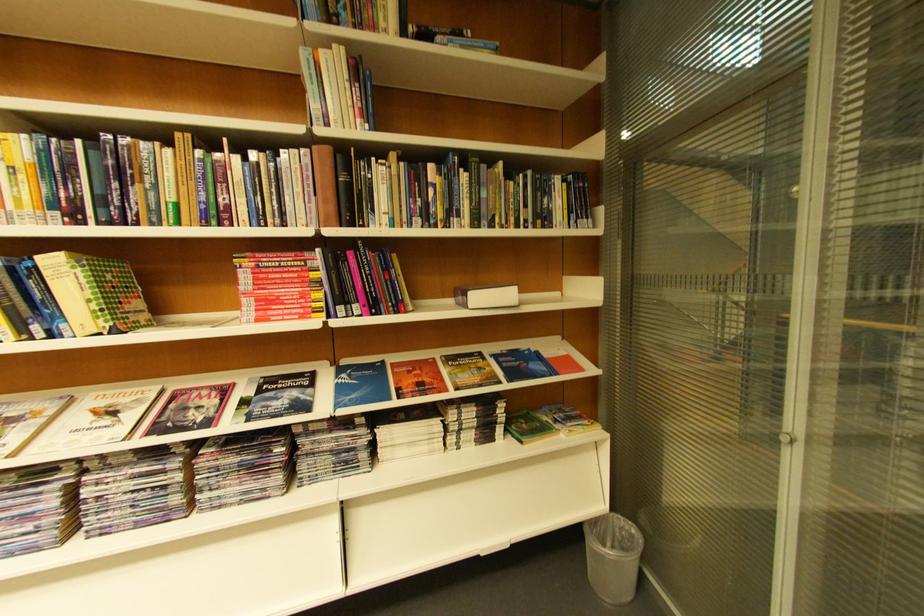
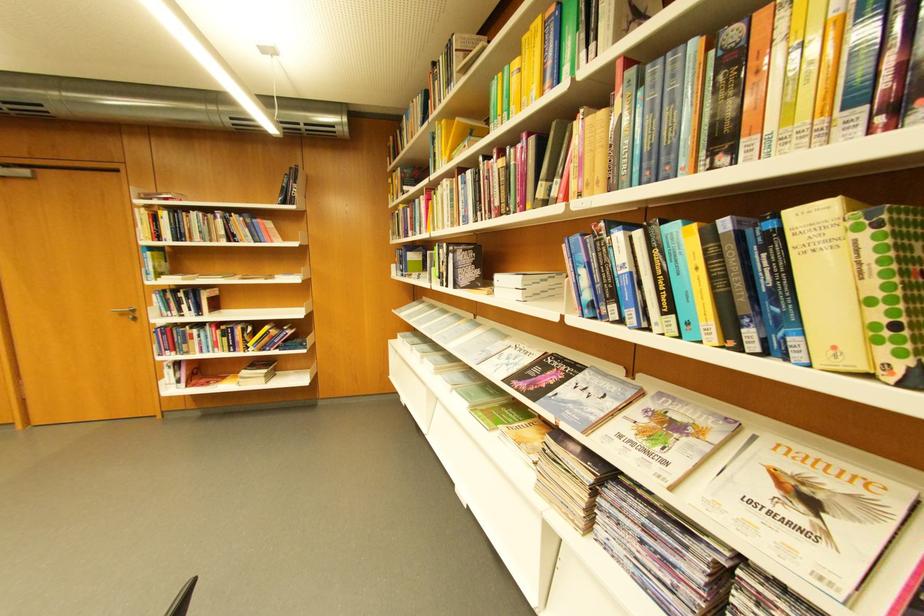
The point at (80, 259) is marked in the first image. Where is the corresponding point in the second image?

(861, 209)